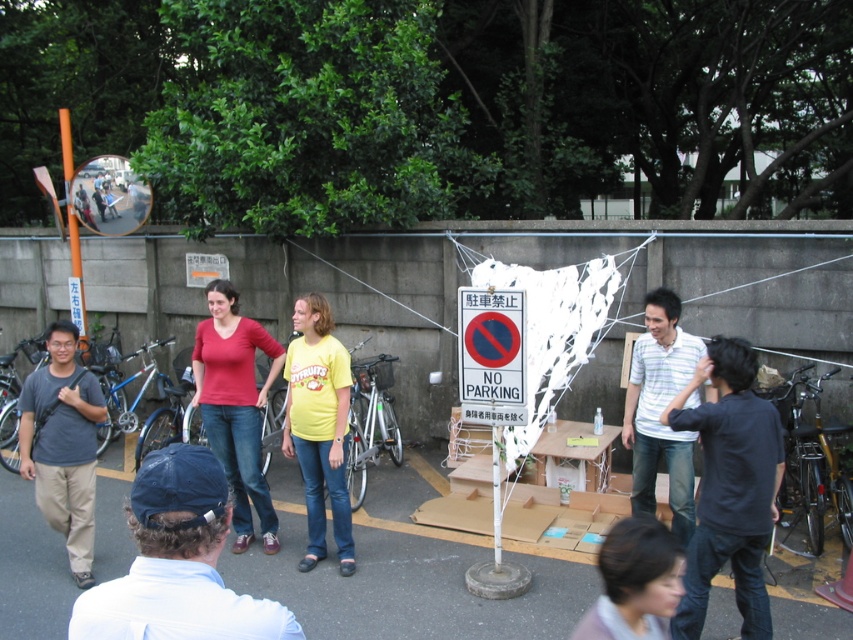
Does white cotton cap at lower left have a smaller size compared to black shirt at right?

Indeed, white cotton cap at lower left has a smaller size compared to black shirt at right.

Is point (125, 600) farther from viewer compared to point (706, 522)?

No, it is not.

This screenshot has width=853, height=640. What do you see at coordinates (177, 563) in the screenshot? I see `white cotton cap at lower left` at bounding box center [177, 563].

Locate an element on the screen. white cotton cap at lower left is located at coordinates [x=177, y=563].

Is white cotton cap at lower left above white striped shirt at center?

Actually, white cotton cap at lower left is below white striped shirt at center.

Between white cotton cap at lower left and white striped shirt at center, which one appears on the right side from the viewer's perspective?

white striped shirt at center is more to the right.

Between point (265, 604) and point (648, 292), which one is positioned in front?

Point (265, 604)

At what (x,y) coordinates should I click in order to perform the action: click on white cotton cap at lower left. Please return your answer as a coordinate pair (x, y). Looking at the image, I should click on (177, 563).

Who is taller, matte gray shirt at left or matte red shirt at center?

matte red shirt at center is taller.

Can you confirm if matte gray shirt at left is positioned to the left of matte red shirt at center?

Yes, matte gray shirt at left is to the left of matte red shirt at center.

Is point (18, 410) in front of point (225, 417)?

That is True.

The image size is (853, 640). I want to click on matte gray shirt at left, so click(62, 444).